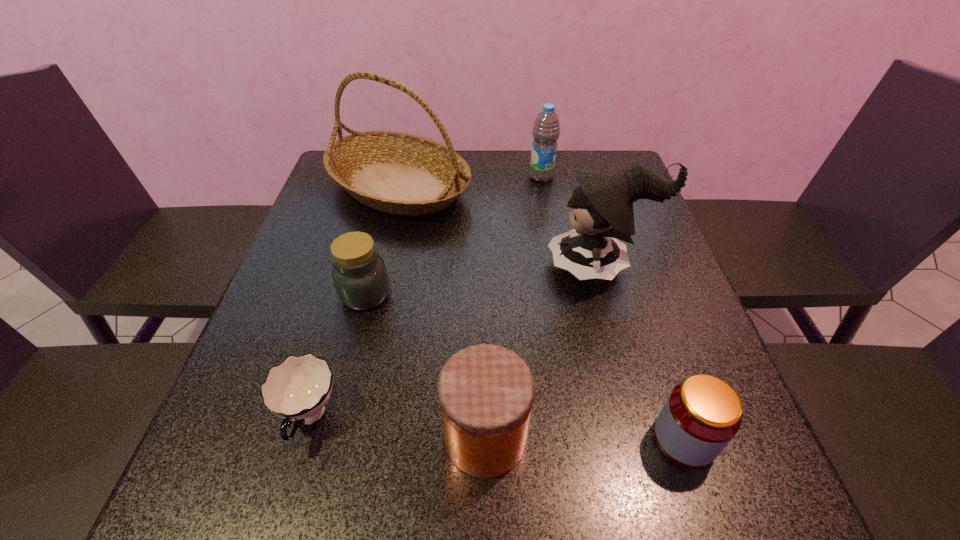
You are a GUI agent. You are given a task and a screenshot of the screen. Output one action in this format:
    pyautogui.click(x=<x>, y=<y>)
    Task: Click on the jar that is positioned at the left edge
    
    Given the screenshot: What is the action you would take?
    pyautogui.click(x=360, y=276)

The image size is (960, 540). What are the coordinates of `cup that is at the left edge` in the screenshot? It's located at (298, 389).

You are a GUI agent. You are given a task and a screenshot of the screen. Output one action in this format:
    pyautogui.click(x=<x>, y=<y>)
    Task: Click on the doll located in the right edge section of the desktop
    Image resolution: width=960 pixels, height=540 pixels.
    Given the screenshot: What is the action you would take?
    pos(602,205)

Locate an element on the screen. jar located in the right edge section of the desktop is located at coordinates (702, 414).

Find the location of a particular element. object that is at the far left corner is located at coordinates (398, 173).

The image size is (960, 540). Identify the location of object present at the near right corner. (702, 414).

Find the location of a particular element. vacant area at the far edge is located at coordinates (468, 190).

Locate an element on the screen. This screenshot has height=540, width=960. vacant space at the near edge of the desktop is located at coordinates click(x=536, y=519).

In the image, there is a desktop. In order to click on free region at the left edge in this screenshot , I will do `click(259, 386)`.

The width and height of the screenshot is (960, 540). In order to click on vacant space at the right edge in this screenshot , I will do `click(655, 277)`.